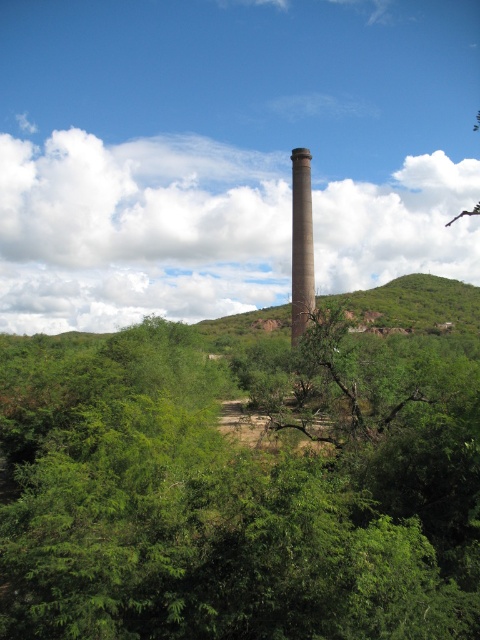
Question: Can you confirm if green leafy tree at center is positioned to the right of green leafy hillside at center?

Choices:
 (A) no
 (B) yes

Answer: (A)

Question: Does green leafy tree at center appear on the right side of green leafy hillside at center?

Choices:
 (A) yes
 (B) no

Answer: (B)

Question: Which object is closer to the camera taking this photo?

Choices:
 (A) brown concrete chimney at center
 (B) green leafy tree at center

Answer: (B)

Question: Which point appears closest to the camera in this image?

Choices:
 (A) (300, 285)
 (B) (403, 292)
 (C) (250, 586)

Answer: (C)

Question: Which object appears closest to the camera in this image?

Choices:
 (A) green leafy tree at center
 (B) green leafy hillside at center

Answer: (A)

Question: Does green leafy tree at center lie behind green leafy hillside at center?

Choices:
 (A) no
 (B) yes

Answer: (A)